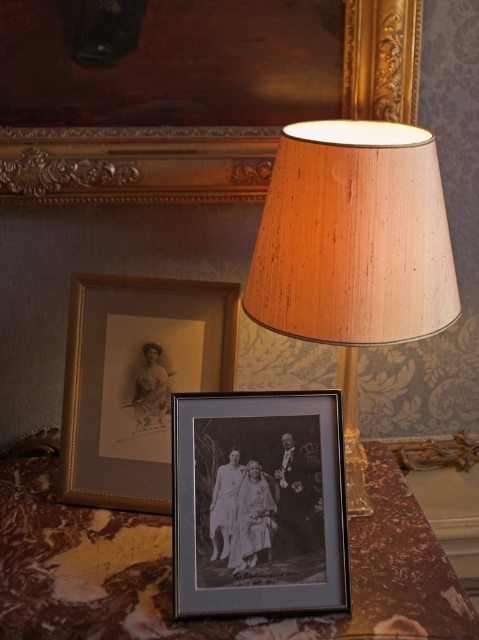
You are standing in the vintage room and need to place a new decorative item on the marble table at center. According to the scene description, where exactly is the marble table positioned?

The marble table at center is located at point (171, 570).

You are standing 1 meter away from the table in the scene. There is a point marked at coordinates point (21, 600). Can you reach this point without moving closer to the table?

The distance of point (21, 600) from viewer is 90.59 centimeters. Since you are standing 1 meter away from the table, which is 100 centimeters, the point is 9.41 centimeters closer than your current position. Therefore, you cannot reach the point without moving closer to the table.